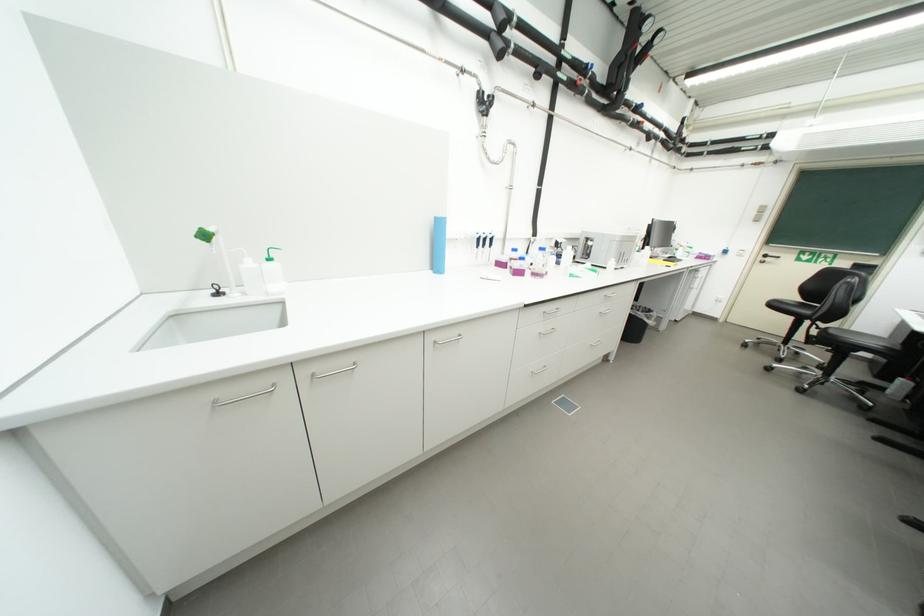
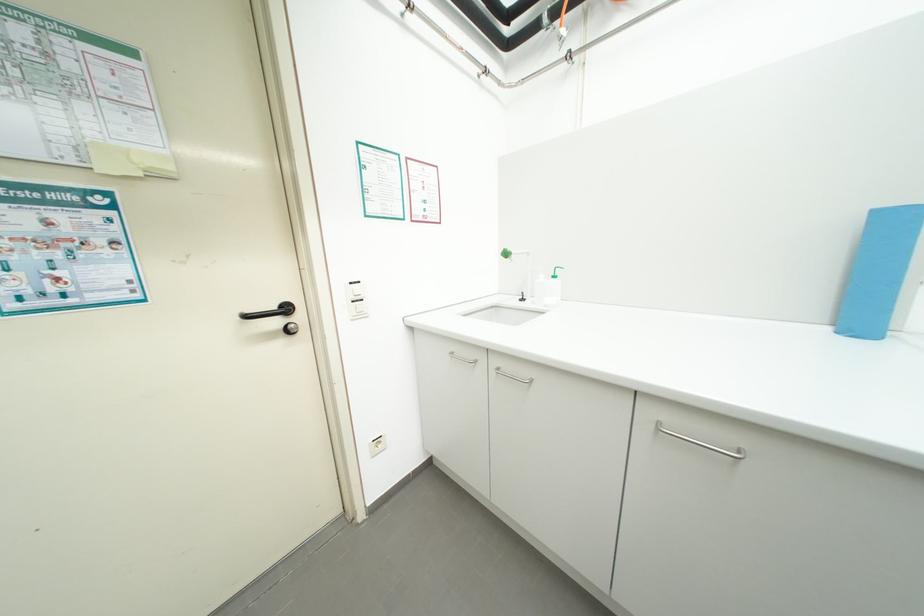
The point at (439, 273) is marked in the first image. Where is the corresponding point in the second image?

(835, 330)